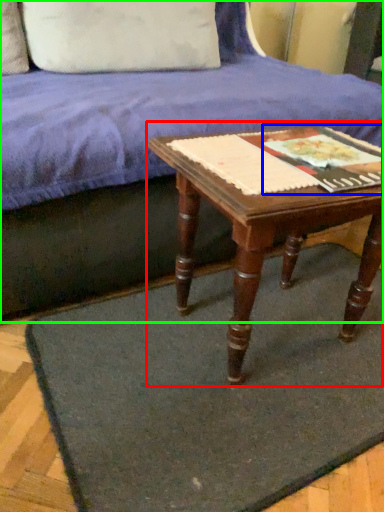
Question: Which object is the closest to the table (highlighted by a red box)? Choose among these: paperback book (highlighted by a blue box) or studio couch (highlighted by a green box).

Choices:
 (A) paperback book
 (B) studio couch

Answer: (A)